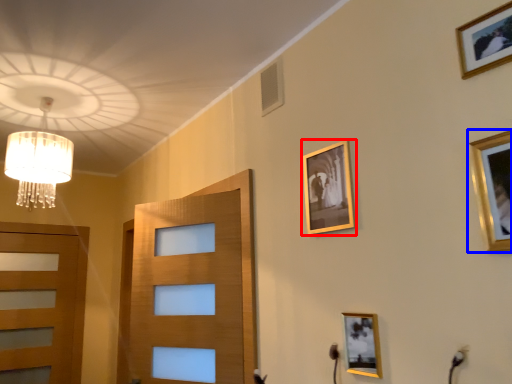
Question: Which of the following is the farthest to the observer, picture frame (highlighted by a red box) or picture frame (highlighted by a blue box)?

Choices:
 (A) picture frame
 (B) picture frame

Answer: (A)